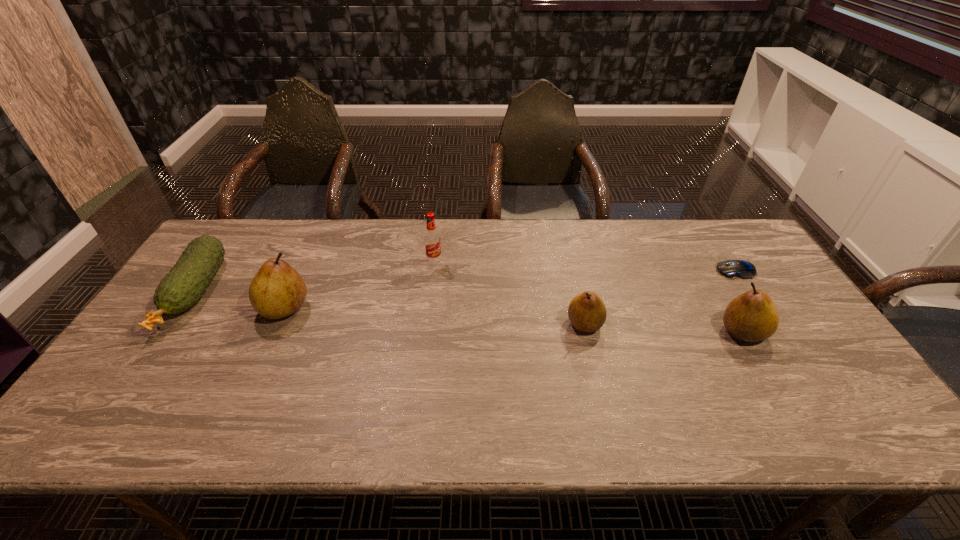
To make them evenly spaced by inserting another pear among them, please locate a free space for this new pear. Please provide its 2D coordinates. Your answer should be formatted as a tuple, i.e. [(x, y)], where the tuple contains the x and y coordinates of a point satisfying the conditions above.

[(432, 316)]